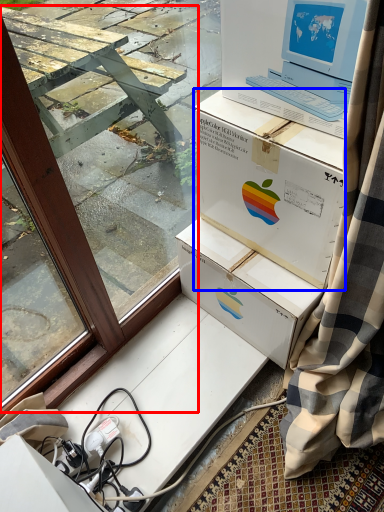
Question: Which object is closer to the camera taking this photo, window frame (highlighted by a red box) or box (highlighted by a blue box)?

Choices:
 (A) window frame
 (B) box

Answer: (A)